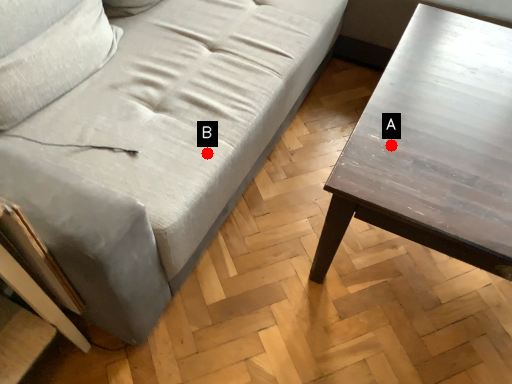
Question: Two points are circled on the image, labeled by A and B beside each circle. Which point appears closest to the camera in this image?

Choices:
 (A) A is closer
 (B) B is closer

Answer: (A)